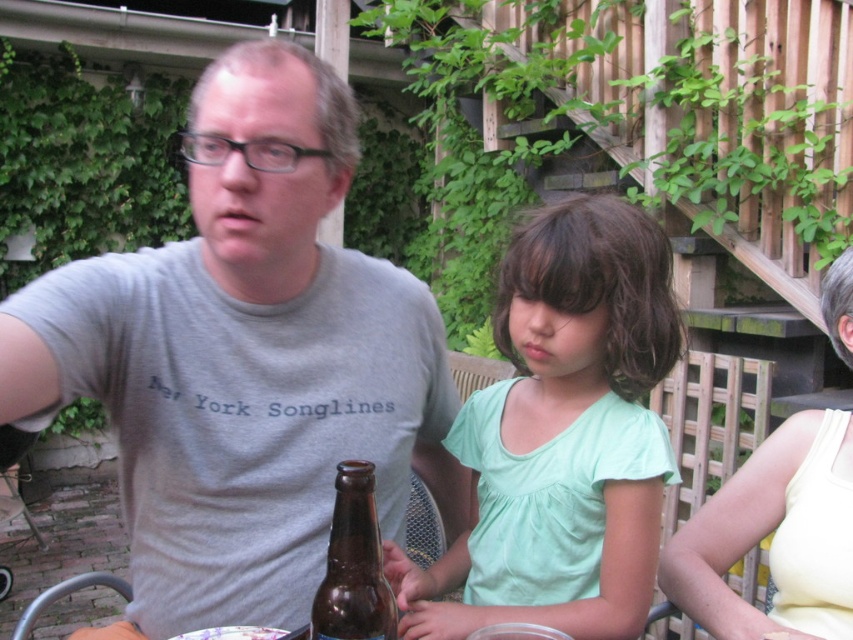
Can you confirm if gray cotton shirt at upper left is bigger than brown glass bottle at center?

Indeed, gray cotton shirt at upper left has a larger size compared to brown glass bottle at center.

Who is positioned more to the right, gray cotton shirt at upper left or brown glass bottle at center?

brown glass bottle at center is more to the right.

Which is in front, point (253, 122) or point (334, 561)?

Point (334, 561) is in front.

The height and width of the screenshot is (640, 853). I want to click on gray cotton shirt at upper left, so click(244, 358).

Is the position of gray cotton shirt at upper left less distant than that of yellow fabric tank top at right?

That is True.

Is gray cotton shirt at upper left positioned behind yellow fabric tank top at right?

No, it is in front of yellow fabric tank top at right.

Which is behind, point (57, 387) or point (705, 627)?

The point (705, 627) is more distant.

Where is `gray cotton shirt at upper left`? The image size is (853, 640). gray cotton shirt at upper left is located at coordinates (244, 358).

Looking at this image, which is below, light green fabric shirt at center or yellow fabric tank top at right?

yellow fabric tank top at right is lower down.

Does light green fabric shirt at center have a smaller size compared to yellow fabric tank top at right?

Incorrect, light green fabric shirt at center is not smaller in size than yellow fabric tank top at right.

At what (x,y) coordinates should I click in order to perform the action: click on light green fabric shirt at center. Please return your answer as a coordinate pair (x, y). The width and height of the screenshot is (853, 640). Looking at the image, I should click on (561, 435).